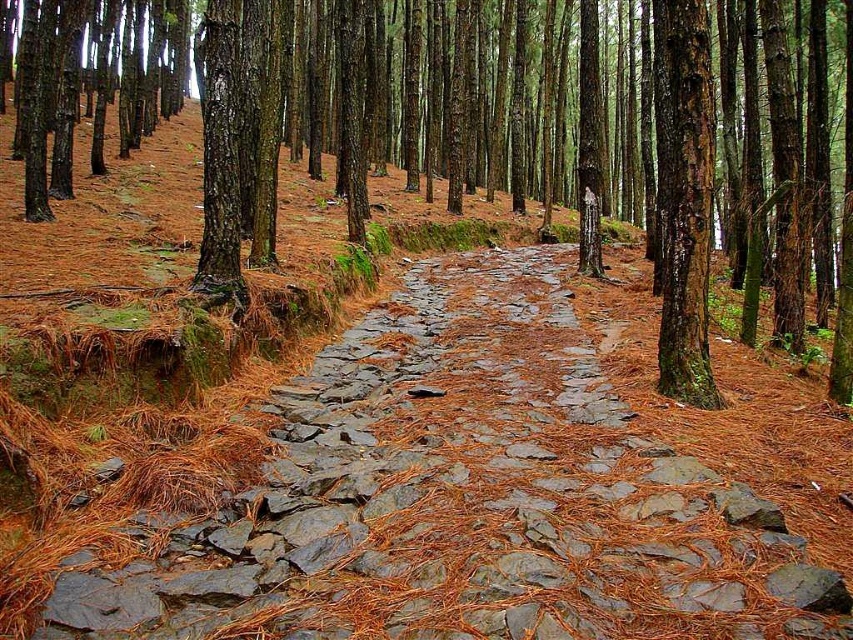
You are a GUI agent. You are given a task and a screenshot of the screen. Output one action in this format:
    pyautogui.click(x=<x>, y=<y>)
    Task: Click on the brown bark tree at center
    The height and width of the screenshot is (640, 853).
    Given the screenshot: What is the action you would take?
    pyautogui.click(x=180, y=237)

Who is shorter, brown bark tree at center or brown rough bark tree at center?

With less height is brown rough bark tree at center.

Does point (717, 145) come behind point (686, 298)?

Yes, point (717, 145) is behind point (686, 298).

Image resolution: width=853 pixels, height=640 pixels. I want to click on brown bark tree at center, so click(x=180, y=237).

Where is `gray stone path at center`? gray stone path at center is located at coordinates (467, 499).

Does gray stone path at center have a larger size compared to brown bark tree at center?

Incorrect, gray stone path at center is not larger than brown bark tree at center.

Which is below, gray stone path at center or brown bark tree at center?

gray stone path at center

I want to click on gray stone path at center, so click(x=467, y=499).